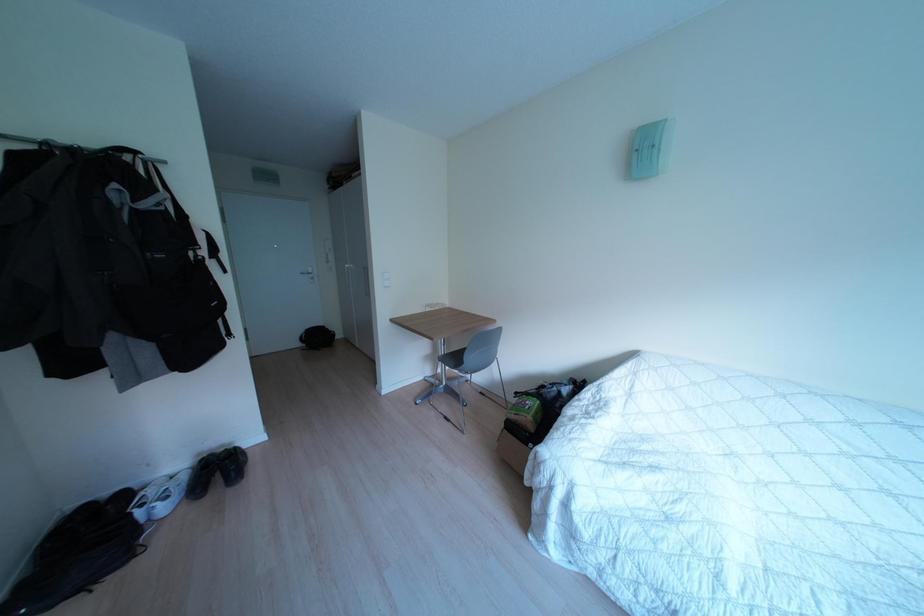
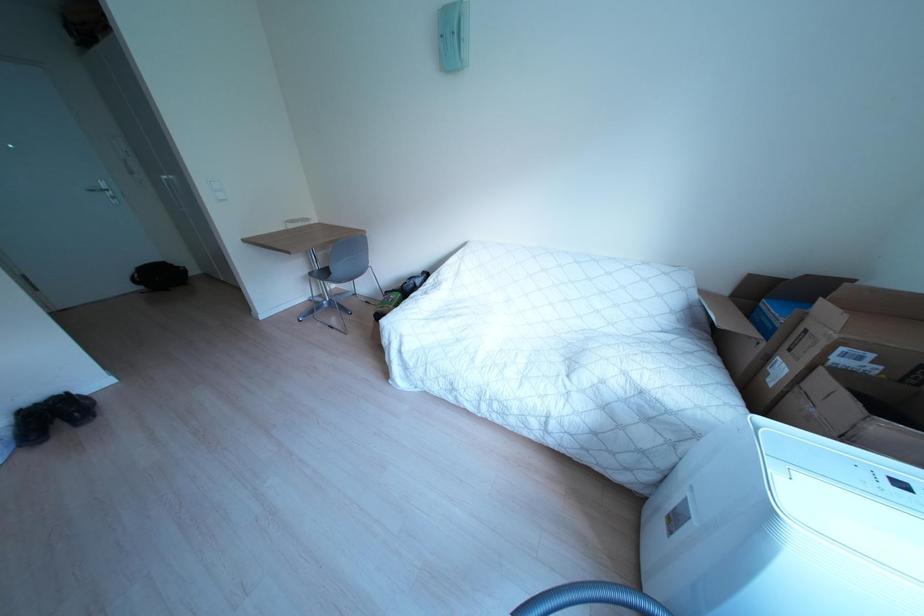
What movement of the cameraman would produce the second image?

The cameraman walked toward right, backward.